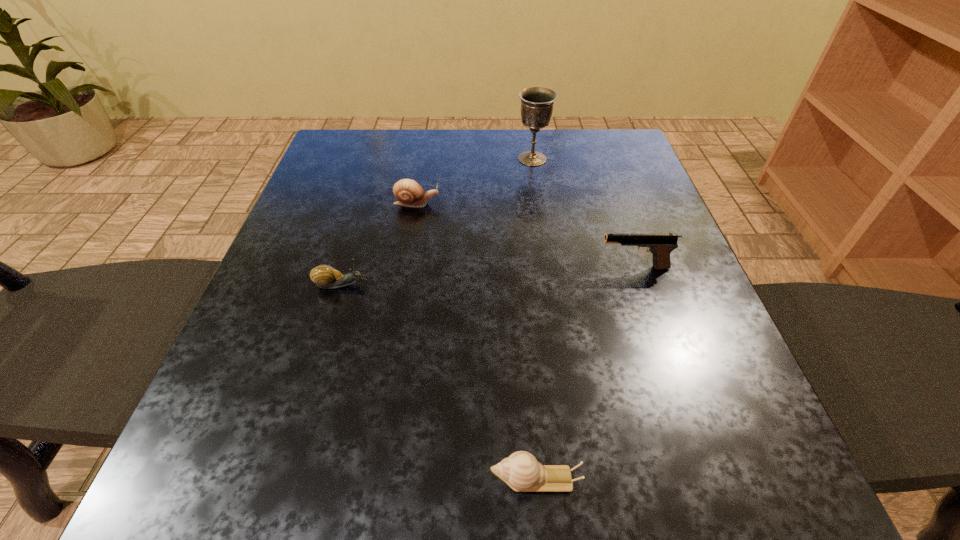
The image size is (960, 540). I want to click on vacant space positioned 0.210m on the front of the tallest object, so click(x=542, y=225).

Find the location of a particular element. This screenshot has width=960, height=540. free region located 0.060m at the muzzle of the fourth shortest object is located at coordinates (565, 267).

At what (x,y) coordinates should I click in order to perform the action: click on blank space located 0.180m at the muzzle of the fourth shortest object. Please return your answer as a coordinate pair (x, y). Image resolution: width=960 pixels, height=540 pixels. Looking at the image, I should click on (499, 267).

This screenshot has width=960, height=540. In order to click on vacant space located at the muzzle of the fourth shortest object in this screenshot , I will do `click(516, 267)`.

Identify the location of free spot located on the front-facing side of the farthest escargot. This screenshot has height=540, width=960. [538, 204].

In order to click on free region located 0.090m on the front-facing side of the leftmost object in this screenshot , I will do tap(420, 285).

At what (x,y) coordinates should I click in order to perform the action: click on vacant space situated on the shell of the nearest escargot. Please return your answer as a coordinate pair (x, y). Looking at the image, I should click on (281, 478).

Locate an element on the screen. vacant space located 0.380m on the shell of the nearest escargot is located at coordinates (184, 478).

Find the location of a particular element. free spot located 0.190m on the shell of the nearest escargot is located at coordinates (338, 478).

You are a GUI agent. You are given a task and a screenshot of the screen. Output one action in this format:
    pyautogui.click(x=<x>, y=<y>)
    Task: Click on the object positioned at the far edge
    Image resolution: width=960 pixels, height=540 pixels.
    Given the screenshot: What is the action you would take?
    pyautogui.click(x=537, y=103)